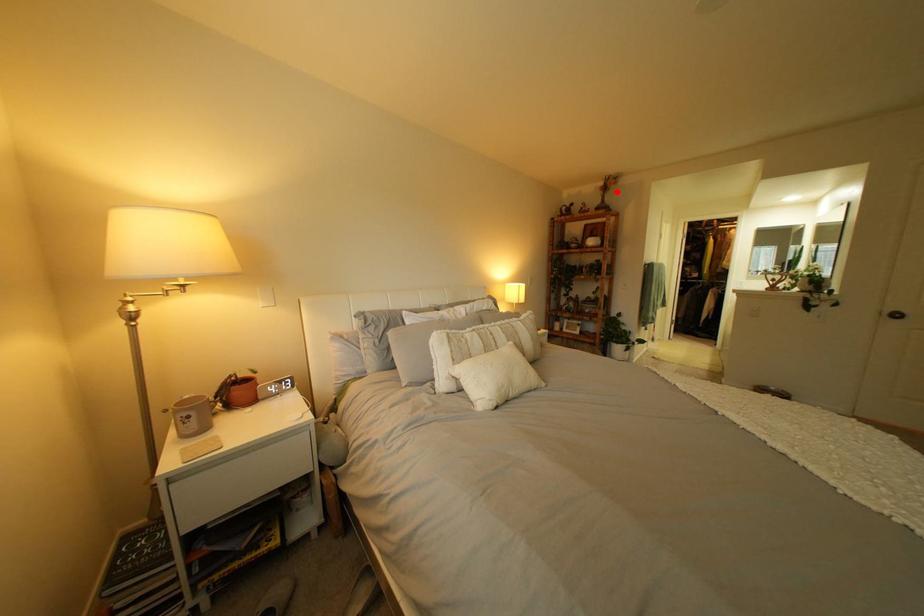
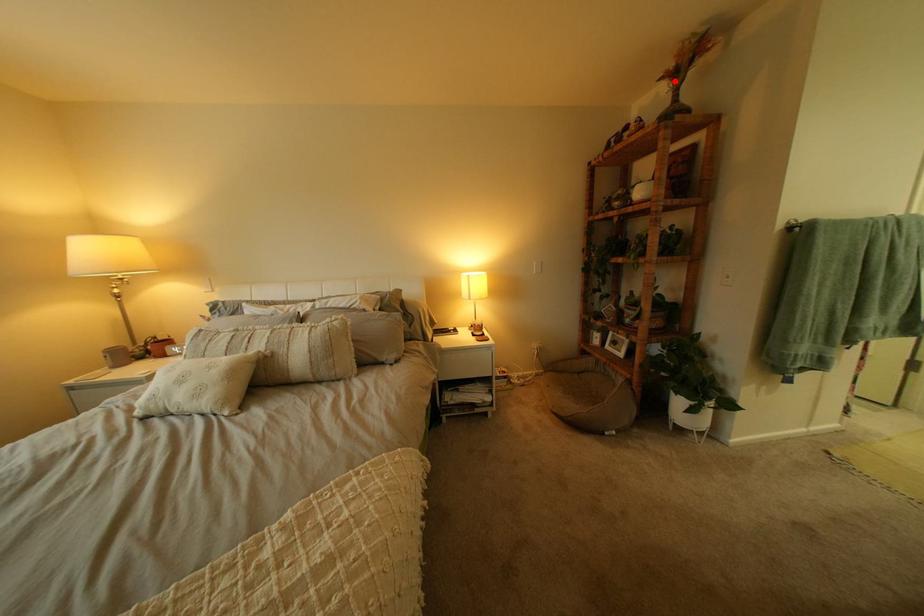
I am providing you with two images of the same scene from different viewpoints. A red point is marked on the first image and another point is marked on the second image. Does the point marked in image1 correspond to the same location as the one in image2?

Yes